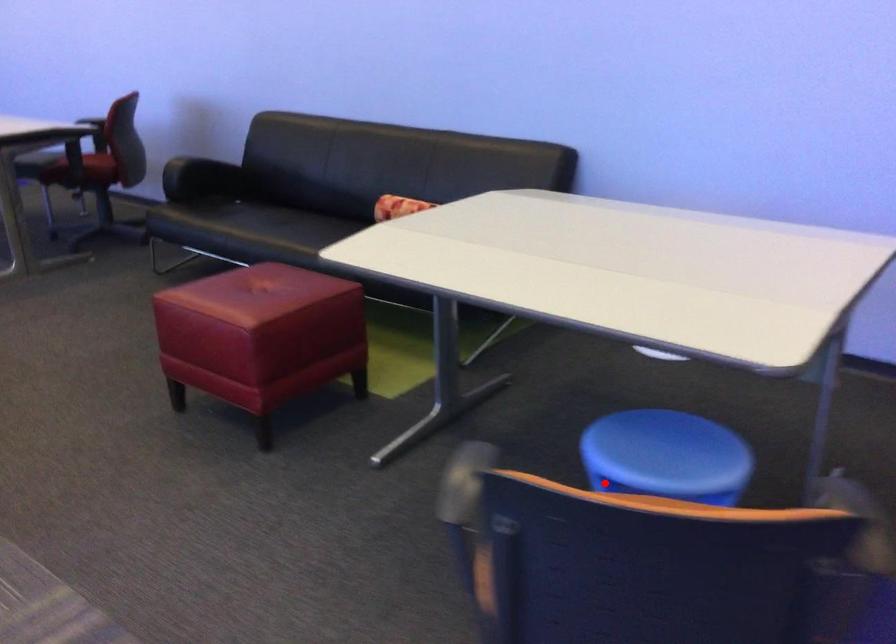
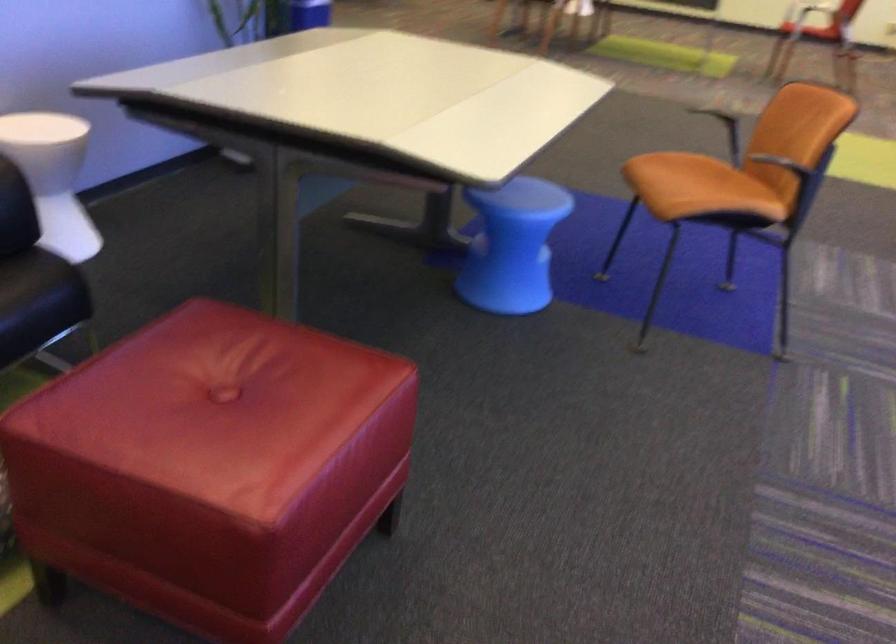
Find the pixel in the second image that matches the highlighted location in the first image.

(512, 245)